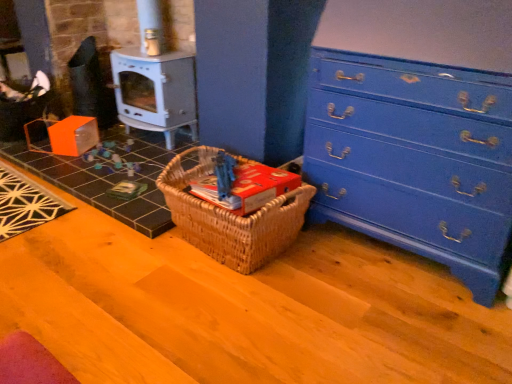
Locate an element on the screen. The width and height of the screenshot is (512, 384). vacant area to the right of woven wood picnic basket at center is located at coordinates (351, 261).